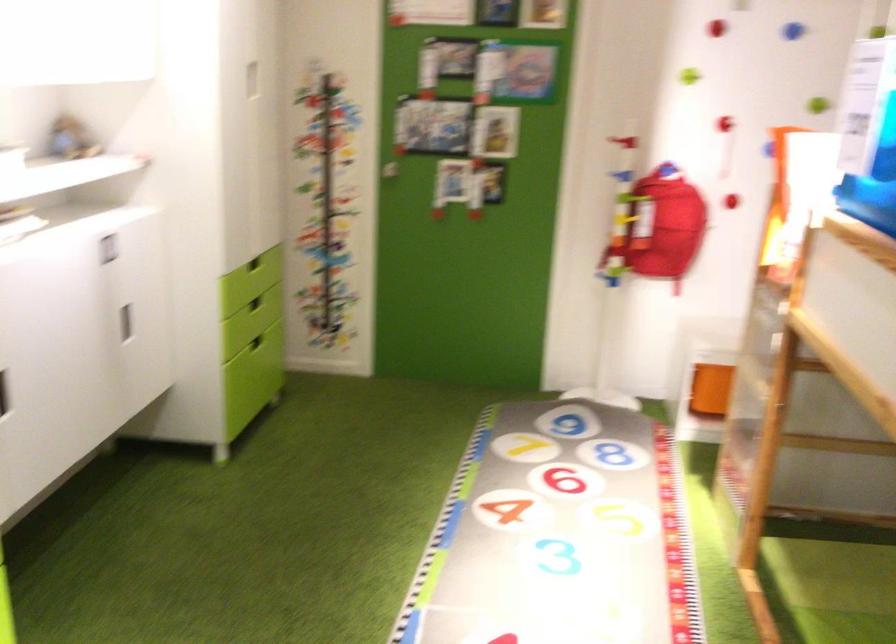
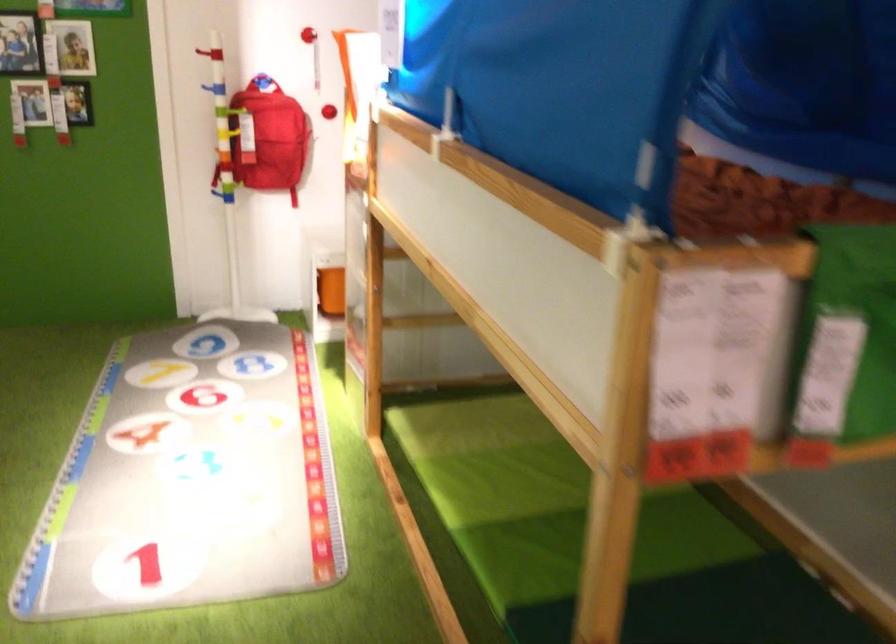
Question: The images are taken continuously from a first-person perspective. In which direction is your viewpoint rotating?

Choices:
 (A) Left
 (B) Right
 (C) Up
 (D) Down

Answer: (B)